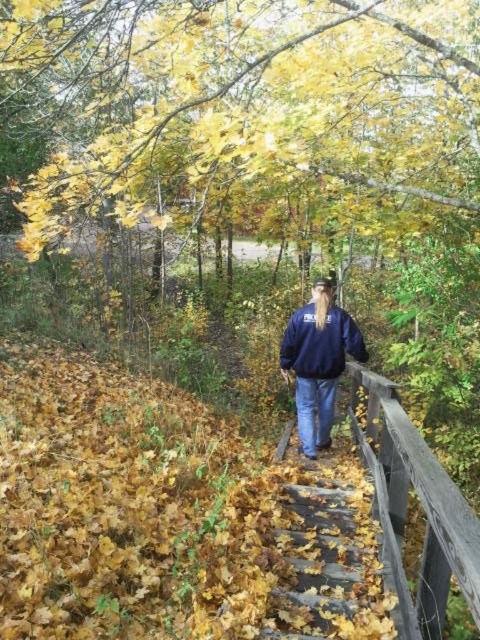
Looking at this image, you are standing on the wooden boardwalk and want to grab your navy blue sweatshirt at center. However, there is a wooden rail at right in your way. Which direction should you move to reach the sweatshirt without hitting the rail?

You should move to the left to reach the navy blue sweatshirt at center because the wooden rail at right is to the right of it, so moving left will avoid the rail.

You are standing on the wooden boardwalk and want to lean against the wooden rail at right while looking at the navy blue sweatshirt at center. Which object is physically larger in the image?

The wooden rail at right is bigger than the navy blue sweatshirt at center in the image.